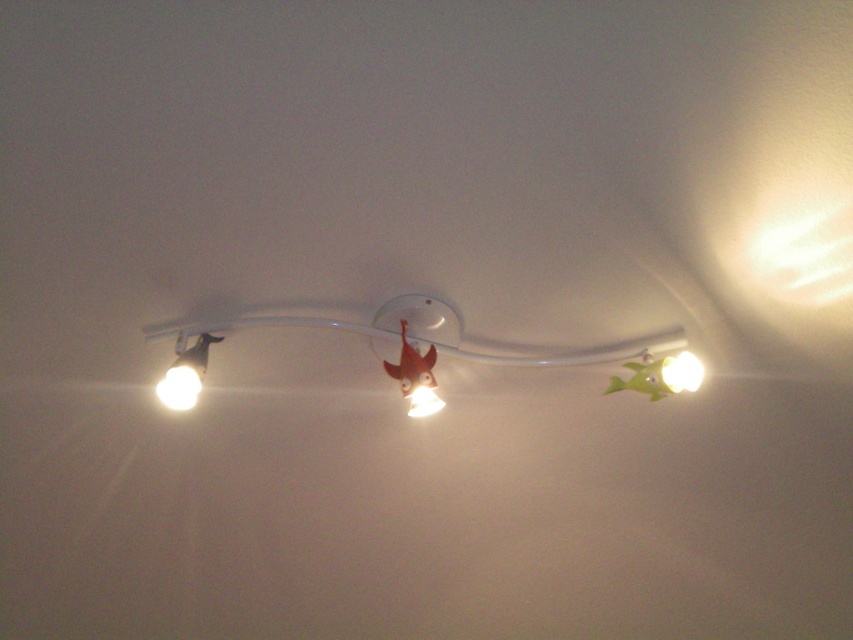
You are a painter standing on a ladder, looking up at the ceiling. You want to paint the matte white spotlight at center. However, the white glossy light at upper right is blocking your view. Can you paint the spotlight without moving the light?

The matte white spotlight at center is behind the white glossy light at upper right, so you cannot paint the spotlight without moving the light because it is obscured by the other light.

You are an interior designer planning to install a new light fixture in a small nursery. You have two options from the image provided. The first option is the matte white spotlight at left, and the second is the white glossy light at upper right. Considering the space constraints, which light has a wider base to ensure it doesn not tip over easily?

The matte white spotlight at left has a wider base than the white glossy light at upper right, making it more stable and less likely to tip over in the nursery.

You are a painter standing 1.2 meters away from a white glossy light at upper right. Can you reach it with a 1.5 meter long pole?

The distance between the white glossy light at upper right and the viewer is 1.08 meters, so a 1.5 meter pole would be sufficient to reach it since it is longer than the distance required.